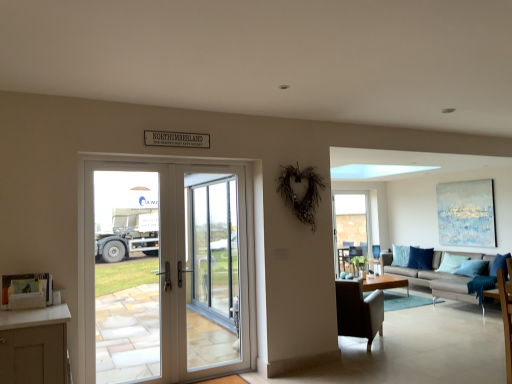
Question: Visually, is brown leather chair at center positioned to the left or to the right of light brown wooden coffee table at center?

Choices:
 (A) left
 (B) right

Answer: (A)

Question: From the image's perspective, is brown leather chair at center above or below light brown wooden coffee table at center?

Choices:
 (A) above
 (B) below

Answer: (A)

Question: Based on their relative distances, which object is farther from the white glossy screen door at center?

Choices:
 (A) white glass door at center
 (B) brown leather chair at center
 (C) blue fabric pillow at right
 (D) light gray fabric couch at center
 (E) blue textured canvas at upper right

Answer: (C)

Question: Estimate the real-world distances between objects in this image. Which object is farther from the light gray fabric couch at center?

Choices:
 (A) light brown wooden coffee table at center
 (B) clear glass window at right
 (C) blue fabric pillow at right
 (D) white glossy screen door at center
 (E) blue textured canvas at upper right

Answer: (D)